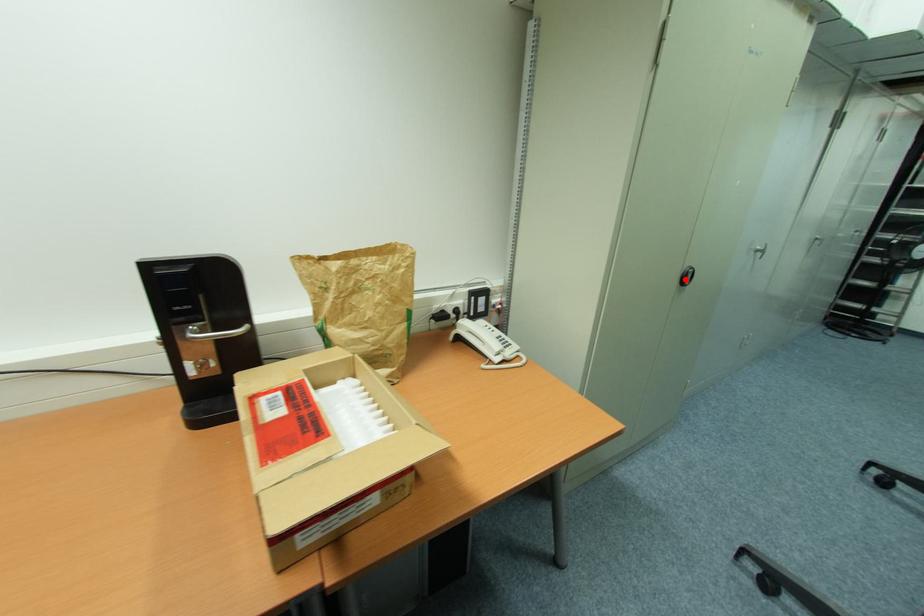
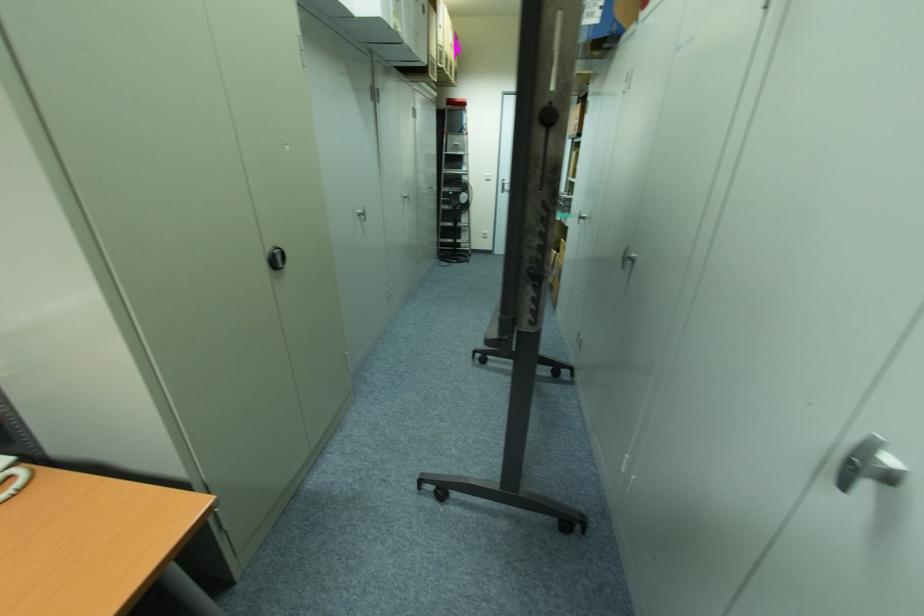
In the second image, find the point that corresponds to the highlighted location in the first image.

(278, 262)